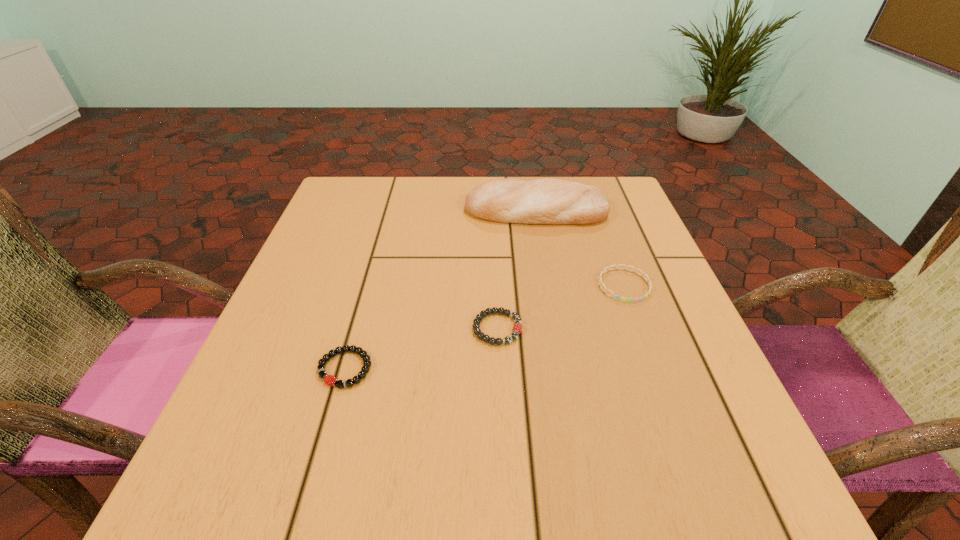
The height and width of the screenshot is (540, 960). In order to click on free space at the right edge of the desktop in this screenshot , I will do `click(658, 429)`.

The height and width of the screenshot is (540, 960). What are the coordinates of `vacant space at the far left corner of the desktop` in the screenshot? It's located at (365, 183).

Find the location of `vacant space at the near left corner of the desktop`. vacant space at the near left corner of the desktop is located at coordinates (221, 494).

Image resolution: width=960 pixels, height=540 pixels. Identify the location of free region at the far right corner of the desktop. (640, 225).

The image size is (960, 540). In the image, there is a desktop. Find the location of `vacant space at the near right corner`. vacant space at the near right corner is located at coordinates coord(735,478).

Locate an element on the screen. The width and height of the screenshot is (960, 540). unoccupied area between the third farthest object and the tallest object is located at coordinates (516, 270).

This screenshot has height=540, width=960. In order to click on vacant area that lies between the second nearest object and the third nearest object in this screenshot , I will do (561, 307).

Identify the location of free space between the rightmost bracelet and the bread. (580, 248).

Locate an element on the screen. This screenshot has height=540, width=960. free space between the second farthest object and the third farthest object is located at coordinates (561, 307).

You are a GUI agent. You are given a task and a screenshot of the screen. Output one action in this format:
    pyautogui.click(x=<x>, y=<y>)
    Task: Click on the free spot between the farthest bracelet and the bread
    
    Given the screenshot: What is the action you would take?
    pyautogui.click(x=580, y=248)